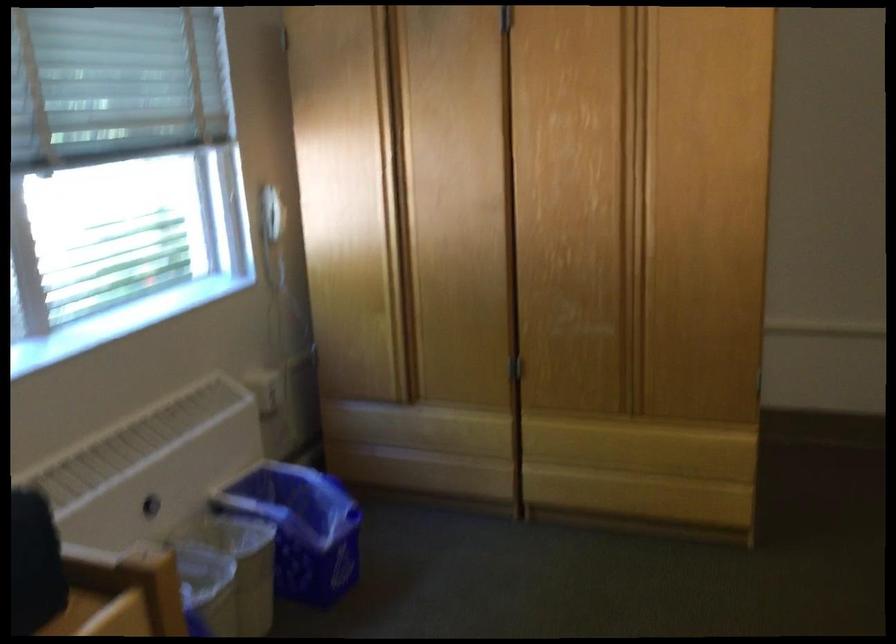
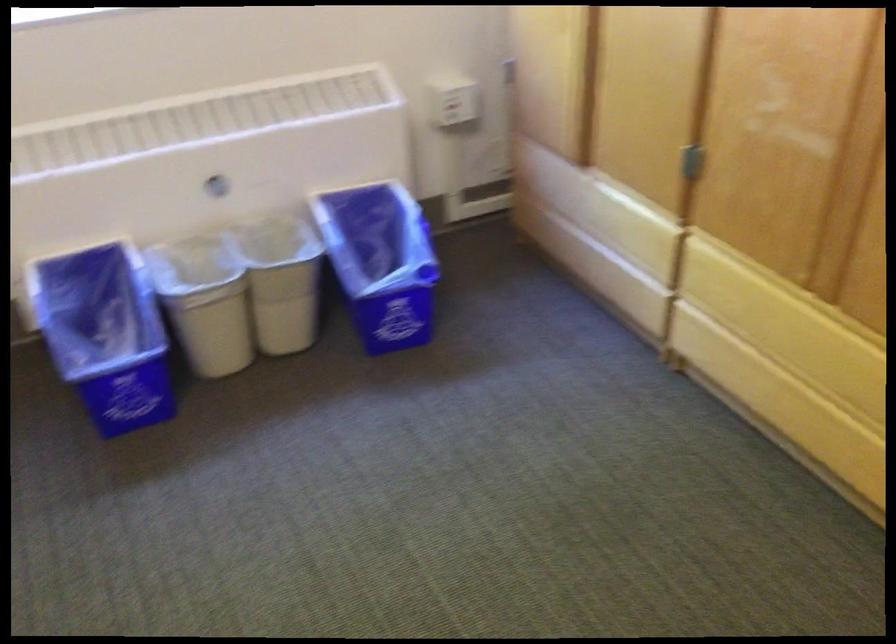
Where in the second image is the point corresponding to (138,515) from the first image?

(218, 187)